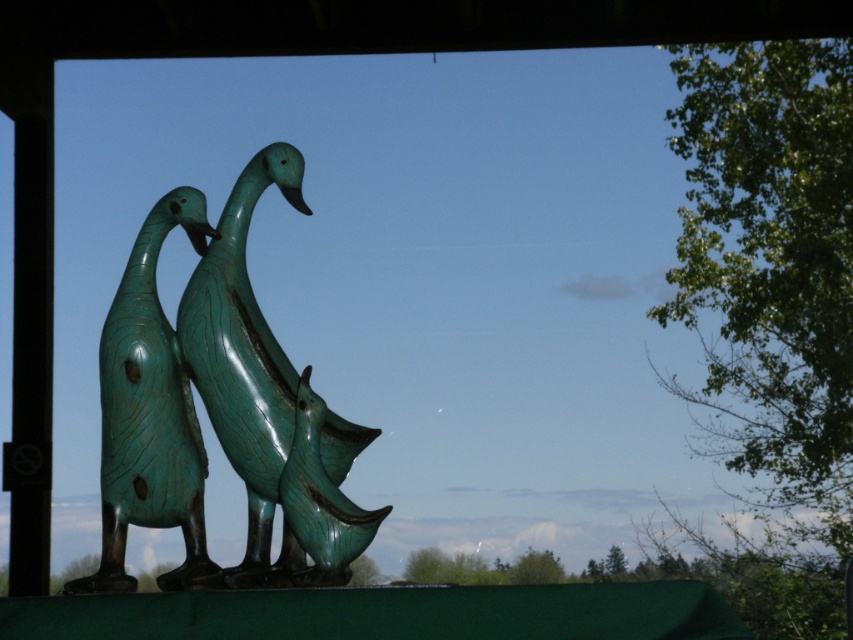
Is green patinated bronze ducks at left shorter than green patinated wood duck at center?

No, green patinated bronze ducks at left is not shorter than green patinated wood duck at center.

Who is lower down, green patinated bronze ducks at left or green patinated wood duck at center?

green patinated wood duck at center is lower down.

Where is `green patinated bronze ducks at left`? The width and height of the screenshot is (853, 640). green patinated bronze ducks at left is located at coordinates (149, 412).

Identify the location of green patinated bronze ducks at left. The height and width of the screenshot is (640, 853). (149, 412).

This screenshot has width=853, height=640. I want to click on green patina sculpture at center, so [270, 404].

Between green patina sculpture at center and green patinated bronze ducks at left, which one appears on the left side from the viewer's perspective?

green patinated bronze ducks at left

Is point (198, 580) farther from camera compared to point (138, 368)?

No, it is not.

At what (x,y) coordinates should I click in order to perform the action: click on green patina sculpture at center. Please return your answer as a coordinate pair (x, y). This screenshot has width=853, height=640. Looking at the image, I should click on (270, 404).

Which of these two, green patina sculpture at center or green patinated wood duck at center, stands shorter?

green patinated wood duck at center is shorter.

Can you confirm if green patina sculpture at center is positioned below green patinated wood duck at center?

No, green patina sculpture at center is not below green patinated wood duck at center.

Is point (234, 346) less distant than point (312, 538)?

No, it is behind (312, 538).

You are a GUI agent. You are given a task and a screenshot of the screen. Output one action in this format:
    pyautogui.click(x=<x>, y=<y>)
    Task: Click on the green patina sculpture at center
    
    Given the screenshot: What is the action you would take?
    pyautogui.click(x=270, y=404)